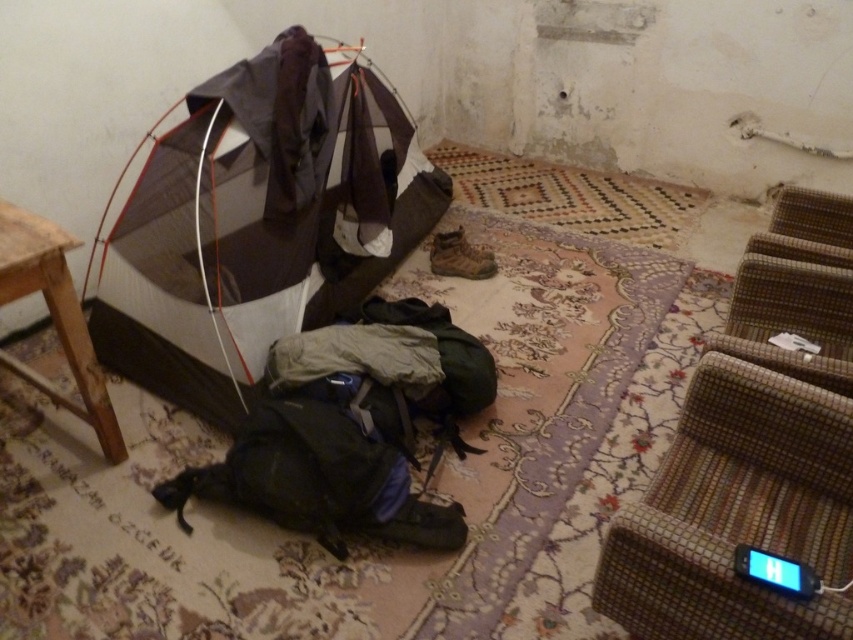
Does gray fabric tent at center have a greater width compared to wooden stool at lower left?

Yes, gray fabric tent at center is wider than wooden stool at lower left.

Between point (378, 84) and point (6, 202), which one is positioned in front?

Point (6, 202) is in front.

The width and height of the screenshot is (853, 640). Identify the location of gray fabric tent at center. (259, 221).

Who is positioned more to the right, gray fabric tent at center or brown woven stool at lower right?

From the viewer's perspective, brown woven stool at lower right appears more on the right side.

Is gray fabric tent at center to the right of brown woven stool at lower right from the viewer's perspective?

In fact, gray fabric tent at center is to the left of brown woven stool at lower right.

The height and width of the screenshot is (640, 853). Identify the location of gray fabric tent at center. (259, 221).

Can you confirm if gray fabric tent at center is positioned below black fabric sleeping bag at center?

Actually, gray fabric tent at center is above black fabric sleeping bag at center.

Is point (206, 172) more distant than point (408, 477)?

That is True.

This screenshot has width=853, height=640. What are the coordinates of `gray fabric tent at center` in the screenshot? It's located at (259, 221).